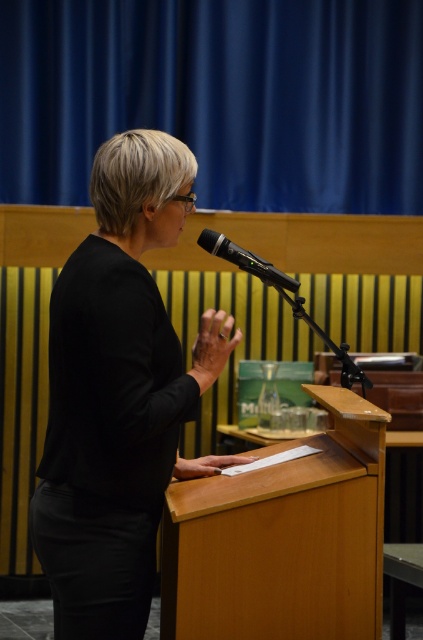
Is black matte shirt at center positioned at the back of light brown wood podium at center?

No, black matte shirt at center is closer to the viewer.

Consider the image. Can you confirm if black matte shirt at center is smaller than light brown wood podium at center?

Actually, black matte shirt at center might be larger than light brown wood podium at center.

What are the coordinates of `black matte shirt at center` in the screenshot? It's located at (118, 394).

Is blue fabric curtain at upper center to the left of black matte shirt at center from the viewer's perspective?

In fact, blue fabric curtain at upper center is to the right of black matte shirt at center.

What are the coordinates of `blue fabric curtain at upper center` in the screenshot? It's located at click(x=219, y=97).

Between point (151, 72) and point (51, 340), which one is positioned behind?

Positioned behind is point (151, 72).

In order to click on blue fabric curtain at upper center in this screenshot , I will do `click(219, 97)`.

Between point (261, 193) and point (279, 272), which one is positioned behind?

Point (261, 193)

Which of these two, blue fabric curtain at upper center or black metallic microphone at center, stands taller?

blue fabric curtain at upper center is taller.

Is point (211, 198) less distant than point (222, 236)?

No, (211, 198) is behind (222, 236).

The height and width of the screenshot is (640, 423). I want to click on blue fabric curtain at upper center, so click(219, 97).